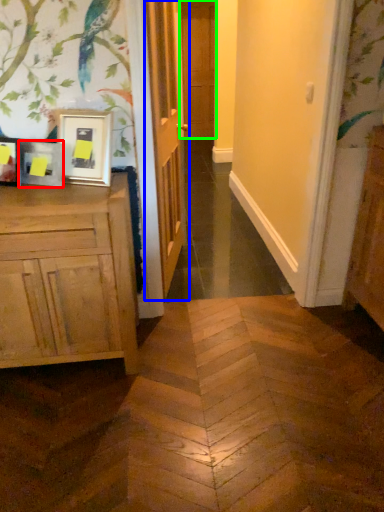
Question: Which object is positioned closest to picture frame (highlighted by a red box)? Select from door (highlighted by a blue box) and door (highlighted by a green box).

Choices:
 (A) door
 (B) door

Answer: (A)